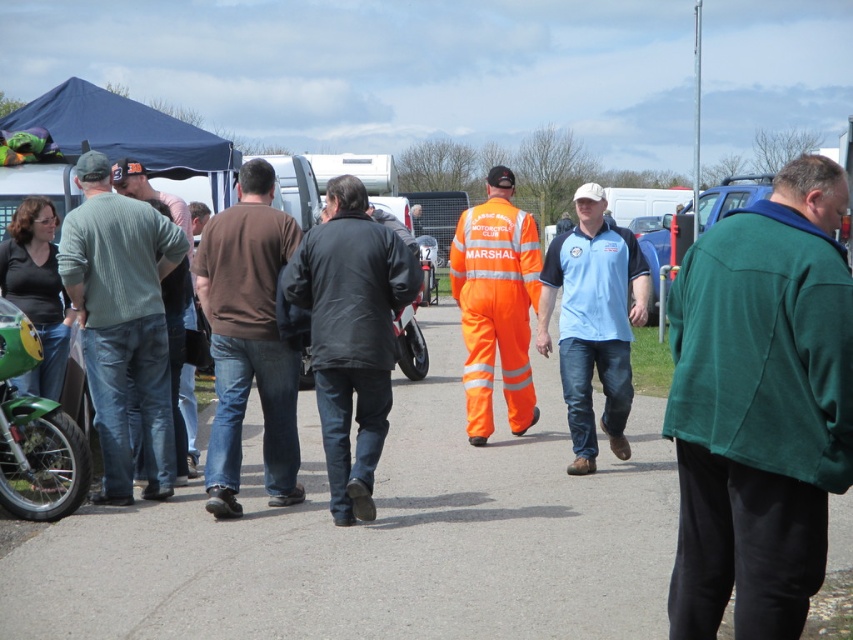
Is light blue fabric shirt at center above orange reflective jumpsuit at center?

Correct, light blue fabric shirt at center is located above orange reflective jumpsuit at center.

Is the position of light blue fabric shirt at center less distant than that of orange reflective jumpsuit at center?

That is True.

Is point (592, 332) positioned behind point (491, 304)?

No.

Find the location of a particular element. light blue fabric shirt at center is located at coordinates (593, 321).

Does light blue fabric shirt at center have a greater width compared to green matte motorcycle at lower left?

Incorrect, light blue fabric shirt at center's width does not surpass green matte motorcycle at lower left's.

Between light blue fabric shirt at center and green matte motorcycle at lower left, which one appears on the left side from the viewer's perspective?

Positioned to the left is green matte motorcycle at lower left.

Where is `light blue fabric shirt at center`? This screenshot has width=853, height=640. light blue fabric shirt at center is located at coordinates coord(593,321).

From the picture: Between dark green fleece jacket at right and green matte motorcycle at lower left, which one has more height?

With more height is dark green fleece jacket at right.

Is dark green fleece jacket at right to the left of green matte motorcycle at lower left from the viewer's perspective?

In fact, dark green fleece jacket at right is to the right of green matte motorcycle at lower left.

Which is behind, point (679, 435) or point (24, 497)?

The point (24, 497) is behind.

The height and width of the screenshot is (640, 853). Find the location of `dark green fleece jacket at right`. dark green fleece jacket at right is located at coordinates (759, 406).